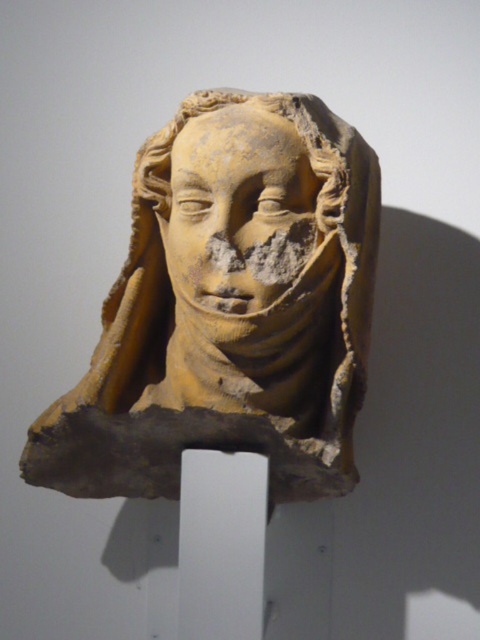
Which is more to the right, earthenware sculpture at center or earthy clay face at center?

From the viewer's perspective, earthenware sculpture at center appears more on the right side.

Does earthenware sculpture at center have a greater width compared to earthy clay face at center?

Indeed, earthenware sculpture at center has a greater width compared to earthy clay face at center.

Does point (179, 371) come behind point (233, 244)?

Yes.

Where is `earthenware sculpture at center`? earthenware sculpture at center is located at coordinates (229, 307).